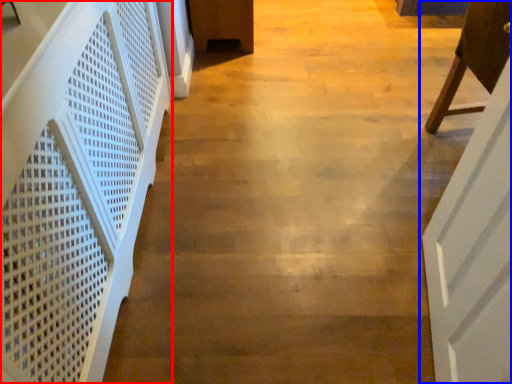
Question: Among these objects, which one is nearest to the camera, stairwell (highlighted by a red box) or door (highlighted by a blue box)?

Choices:
 (A) stairwell
 (B) door

Answer: (A)